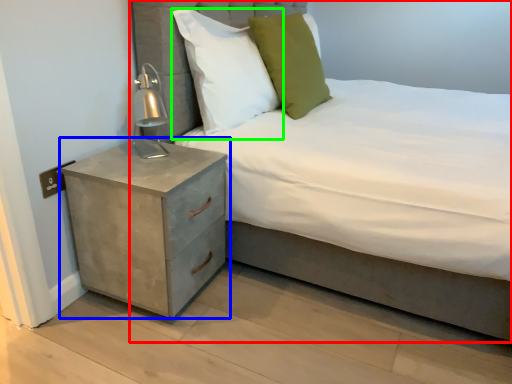
Question: Estimate the real-world distances between objects in this image. Which object is closer to bed (highlighted by a red box), nightstand (highlighted by a blue box) or pillow (highlighted by a green box)?

Choices:
 (A) nightstand
 (B) pillow

Answer: (A)